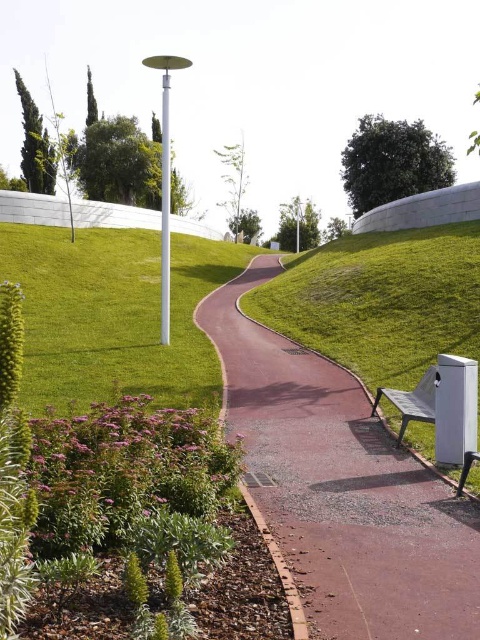
Question: Estimate the real-world distances between objects in this image. Which object is closer to the metallic silver bench at lower right?

Choices:
 (A) green grass at lower left
 (B) pink rubber path at center

Answer: (B)

Question: Can you confirm if green grass at lower left is bigger than metallic silver bench at lower right?

Choices:
 (A) yes
 (B) no

Answer: (A)

Question: Can you confirm if pink rubber path at center is positioned to the right of metallic silver bench at lower right?

Choices:
 (A) no
 (B) yes

Answer: (A)

Question: Which object is positioned closest to the pink rubber path at center?

Choices:
 (A) green grass at lower left
 (B) metallic silver bench at lower right

Answer: (B)

Question: Which object is positioned farthest from the metallic silver bench at lower right?

Choices:
 (A) pink rubber path at center
 (B) green grass at lower left

Answer: (B)

Question: Does pink rubber path at center have a larger size compared to metallic silver bench at lower right?

Choices:
 (A) yes
 (B) no

Answer: (A)